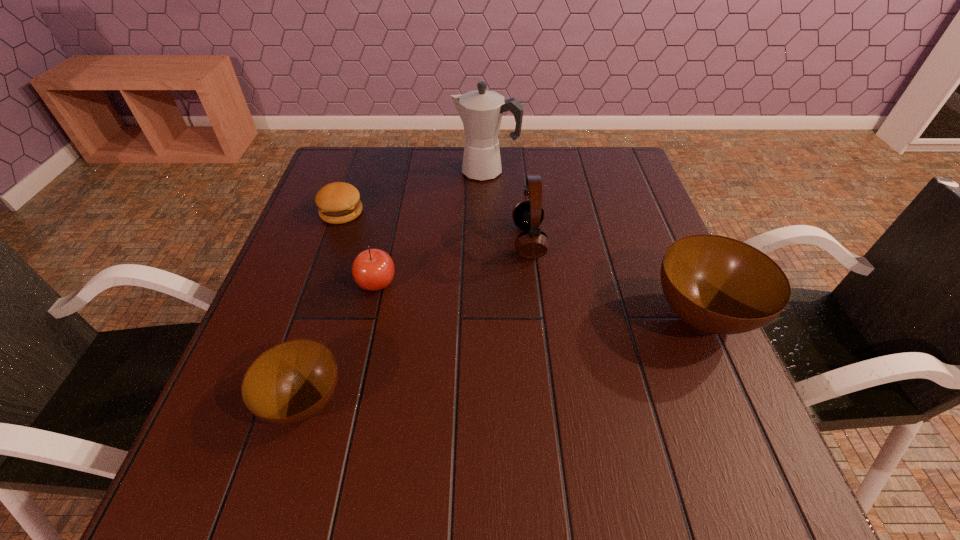
Locate an element on the screen. The height and width of the screenshot is (540, 960). free location at the near right corner is located at coordinates (658, 409).

Locate an element on the screen. This screenshot has height=540, width=960. vacant area between the shorter bowl and the taller bowl is located at coordinates (503, 359).

Locate an element on the screen. free area in between the tallest object and the fourth tallest object is located at coordinates (431, 227).

Where is `vacant area that lies between the fifth shortest object and the hamburger`? vacant area that lies between the fifth shortest object and the hamburger is located at coordinates (435, 227).

I want to click on free space between the tallest object and the apple, so click(x=431, y=227).

I want to click on vacant space that is in between the hamburger and the apple, so click(359, 248).

At what (x,y) coordinates should I click in order to perform the action: click on vacant point located between the apple and the hamburger. Please return your answer as a coordinate pair (x, y). Looking at the image, I should click on (359, 248).

Locate an element on the screen. The width and height of the screenshot is (960, 540). free space between the farthest object and the shorter bowl is located at coordinates (395, 286).

This screenshot has width=960, height=540. I want to click on vacant point located between the nearer bowl and the coffeepot, so click(395, 286).

This screenshot has height=540, width=960. Identify the location of empty space between the coffeepot and the apple. (431, 227).